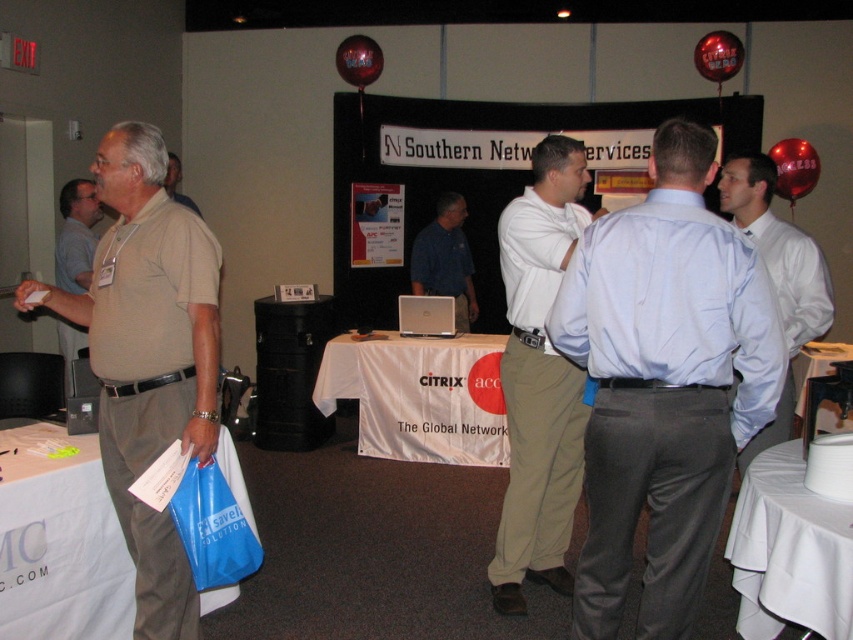
Question: Is khakimaterial/texture at left wider than khaki pants at center?

Choices:
 (A) yes
 (B) no

Answer: (A)

Question: Is white fabric table at lower left smaller than white plastic table at lower right?

Choices:
 (A) no
 (B) yes

Answer: (A)

Question: Does white plastic table at lower right come in front of brown shirt at left?

Choices:
 (A) yes
 (B) no

Answer: (A)

Question: Which point is closer to the camera taking this photo?

Choices:
 (A) (122, 408)
 (B) (524, 557)
 (C) (347, 65)
 (D) (770, 595)

Answer: (D)

Question: Which of the following is the closest to the observer?

Choices:
 (A) blue shirt at center
 (B) beige cotton polo shirt at left
 (C) shiny metallic balloon at upper right

Answer: (B)

Question: Considering the real-world distances, which object is farthest from the brown shirt at left?

Choices:
 (A) white plastic table at lower right
 (B) metallic reflective balloon at upper center

Answer: (A)